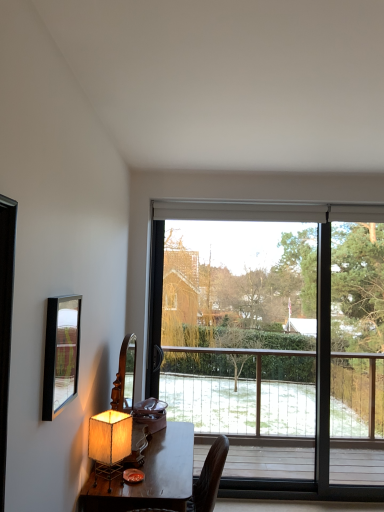
Question: Considering the relative sizes of wooden desk at lower left and matte black mirror at left in the image provided, is wooden desk at lower left taller than matte black mirror at left?

Choices:
 (A) no
 (B) yes

Answer: (B)

Question: Can you confirm if wooden desk at lower left is thinner than matte black mirror at left?

Choices:
 (A) yes
 (B) no

Answer: (B)

Question: Does wooden desk at lower left appear on the left side of matte black mirror at left?

Choices:
 (A) no
 (B) yes

Answer: (A)

Question: Is wooden desk at lower left shorter than matte black mirror at left?

Choices:
 (A) no
 (B) yes

Answer: (A)

Question: Is wooden desk at lower left not inside matte black mirror at left?

Choices:
 (A) no
 (B) yes

Answer: (B)

Question: Is wooden desk at lower left looking in the opposite direction of matte black mirror at left?

Choices:
 (A) yes
 (B) no

Answer: (B)

Question: Is matte black mirror at left positioned in front of matte beige lampshade at lower left?

Choices:
 (A) no
 (B) yes

Answer: (B)

Question: Is matte black mirror at left turned away from matte beige lampshade at lower left?

Choices:
 (A) no
 (B) yes

Answer: (A)

Question: Can you confirm if matte black mirror at left is thinner than matte beige lampshade at lower left?

Choices:
 (A) no
 (B) yes

Answer: (B)

Question: From the image's perspective, is matte black mirror at left beneath matte beige lampshade at lower left?

Choices:
 (A) yes
 (B) no

Answer: (B)

Question: Is matte black mirror at left facing towards matte beige lampshade at lower left?

Choices:
 (A) no
 (B) yes

Answer: (A)

Question: Considering the relative positions of matte black mirror at left and matte beige lampshade at lower left in the image provided, is matte black mirror at left to the left of matte beige lampshade at lower left from the viewer's perspective?

Choices:
 (A) no
 (B) yes

Answer: (B)

Question: Considering the relative positions of matte beige lampshade at lower left and transparent glass window at center in the image provided, is matte beige lampshade at lower left in front of transparent glass window at center?

Choices:
 (A) yes
 (B) no

Answer: (A)